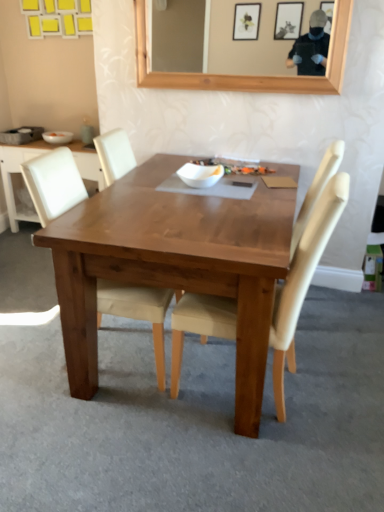
Where is `free space in front of white matte bowl at center, acting as the second bowl starting from the left`? free space in front of white matte bowl at center, acting as the second bowl starting from the left is located at coordinates (204, 199).